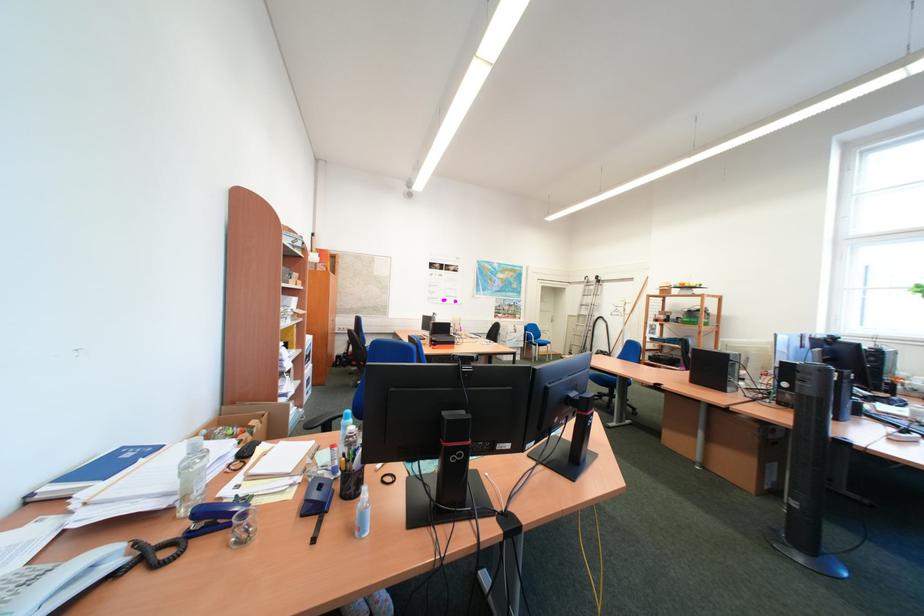
At what (x,y) coordinates should I click in order to perform the action: click on plastic water bottle. Please return your answer as a coordinate pair (x, y). The width and height of the screenshot is (924, 616). Looking at the image, I should click on (191, 476).